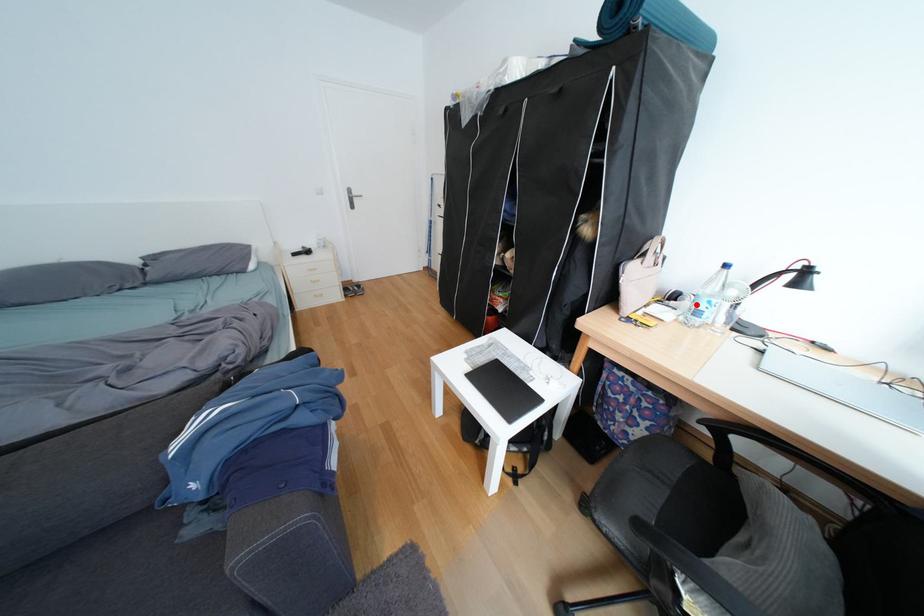
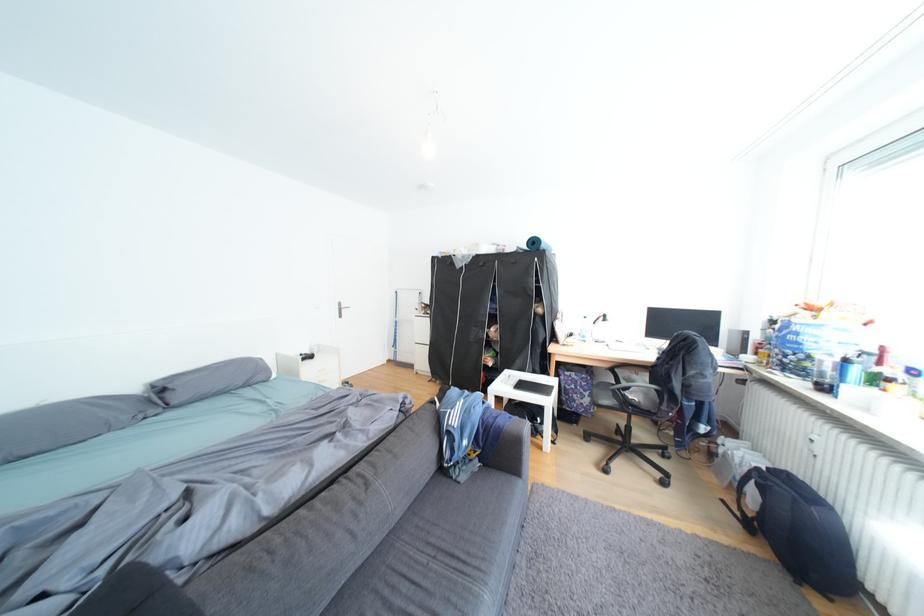
Where in the second image is the point corresponding to the highlighted location from the first image?

(590, 337)